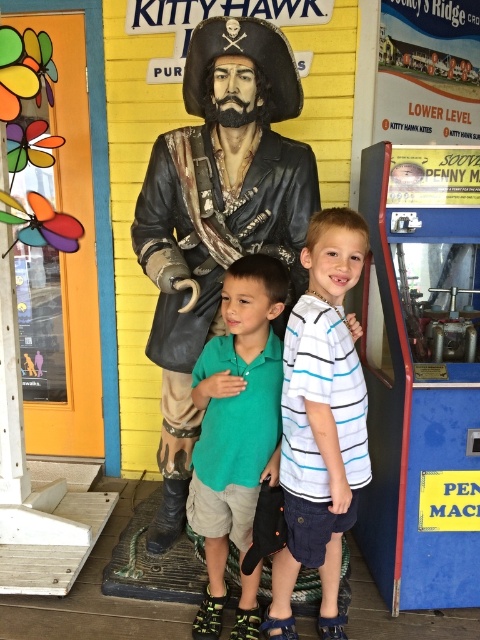
Question: Observing the image, what is the correct spatial positioning of white striped shirt at center in reference to green cotton polo shirt at center?

Choices:
 (A) below
 (B) above

Answer: (B)

Question: Can you confirm if bronze pirate at center is positioned to the left of green cotton polo shirt at center?

Choices:
 (A) yes
 (B) no

Answer: (A)

Question: Which object appears farthest from the camera in this image?

Choices:
 (A) green cotton polo shirt at center
 (B) bronze pirate at center
 (C) white striped shirt at center

Answer: (B)

Question: Which of the following is the closest to the observer?

Choices:
 (A) green cotton polo shirt at center
 (B) white striped shirt at center

Answer: (B)

Question: Which of these objects is positioned farthest from the bronze pirate at center?

Choices:
 (A) green cotton polo shirt at center
 (B) white striped shirt at center

Answer: (B)

Question: Is bronze pirate at center wider than green cotton polo shirt at center?

Choices:
 (A) no
 (B) yes

Answer: (B)